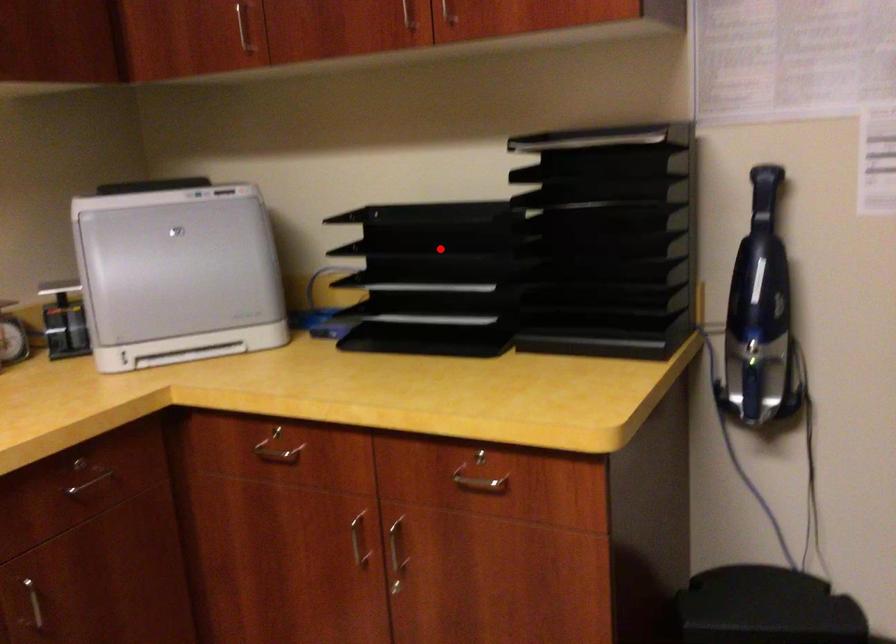
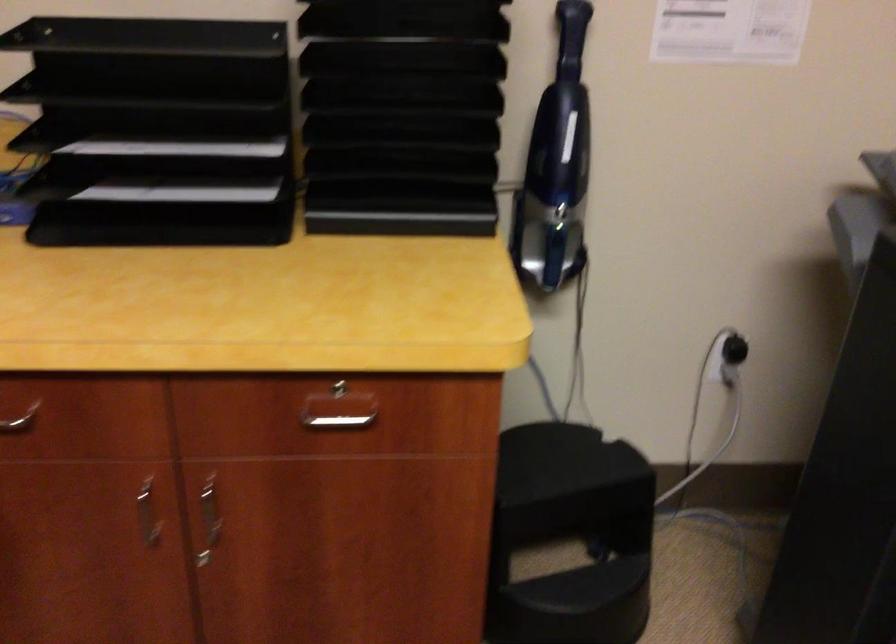
Find the pixel in the second image that matches the highlighted location in the first image.

(156, 89)